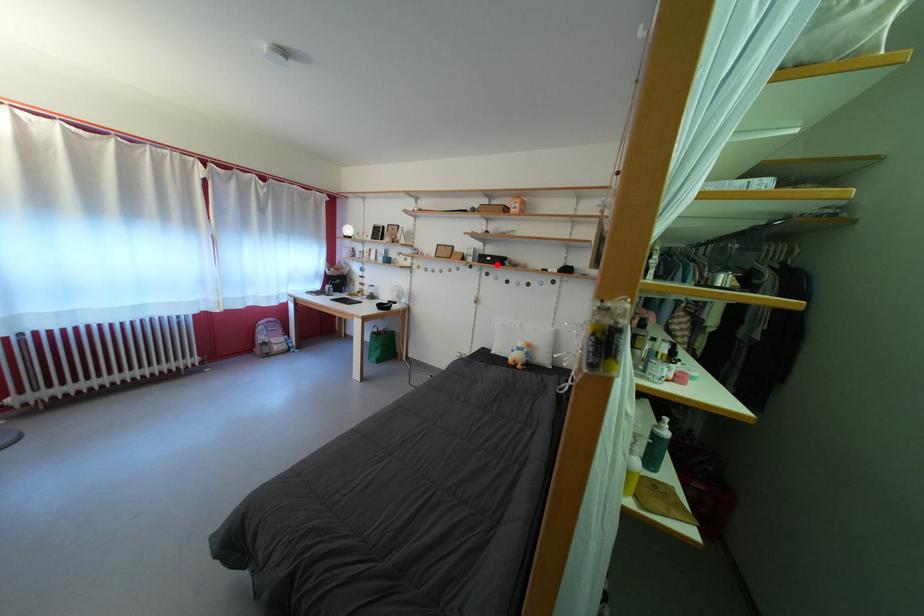
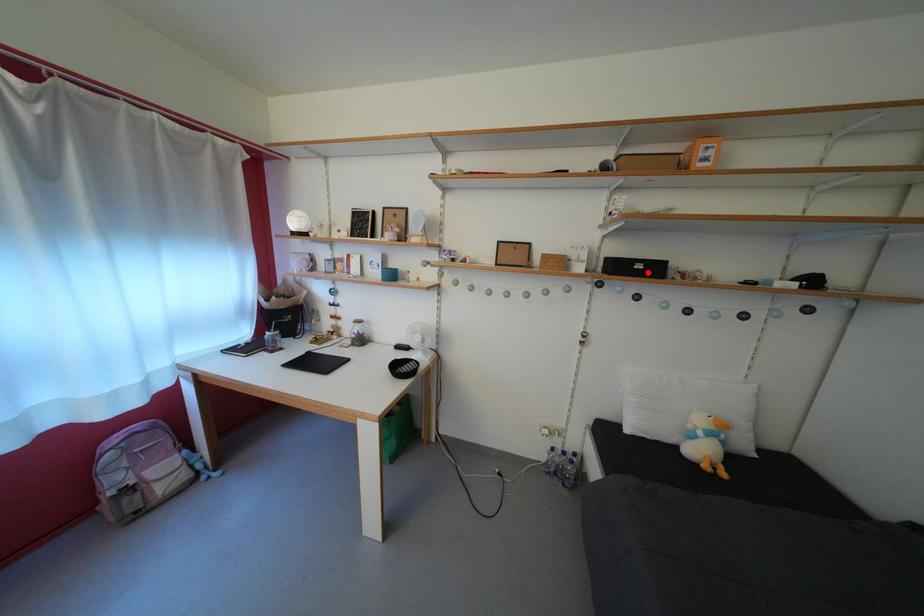
I am providing you with two images of the same scene from different viewpoints. A red point is marked on the first image and another point is marked on the second image. Is the marked point in image1 the same physical position as the marked point in image2?

Yes